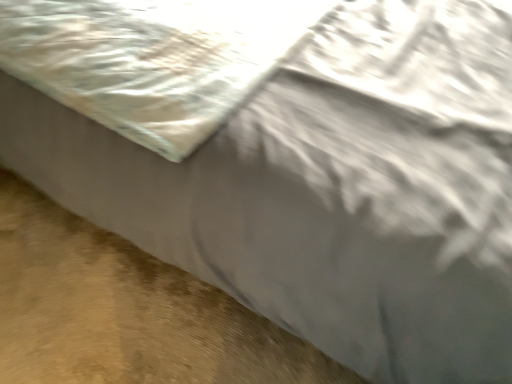
Locate an element on the screen. white satin blanket at upper left is located at coordinates (152, 59).

The height and width of the screenshot is (384, 512). What do you see at coordinates (152, 59) in the screenshot? I see `white satin blanket at upper left` at bounding box center [152, 59].

Find the location of a particular element. white satin blanket at upper left is located at coordinates (152, 59).